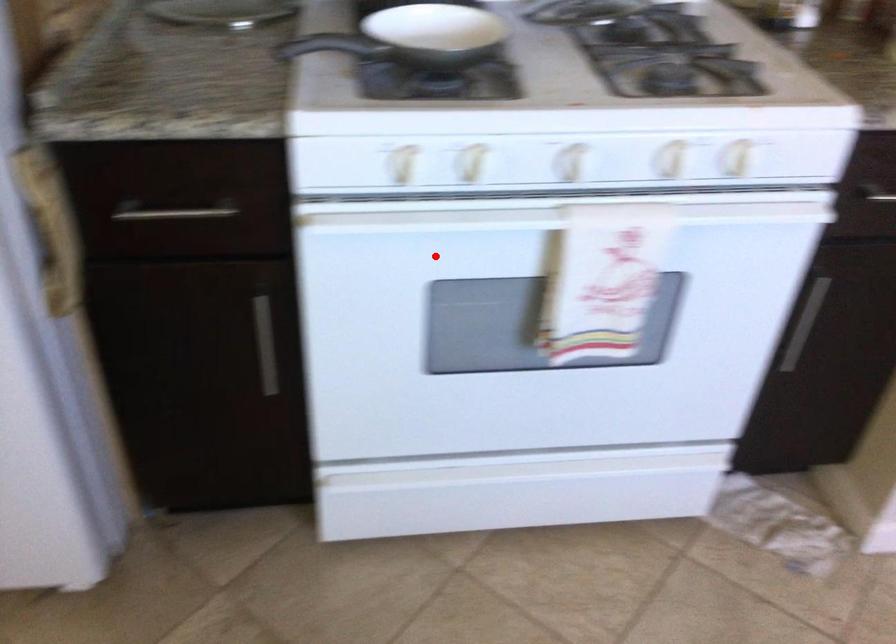
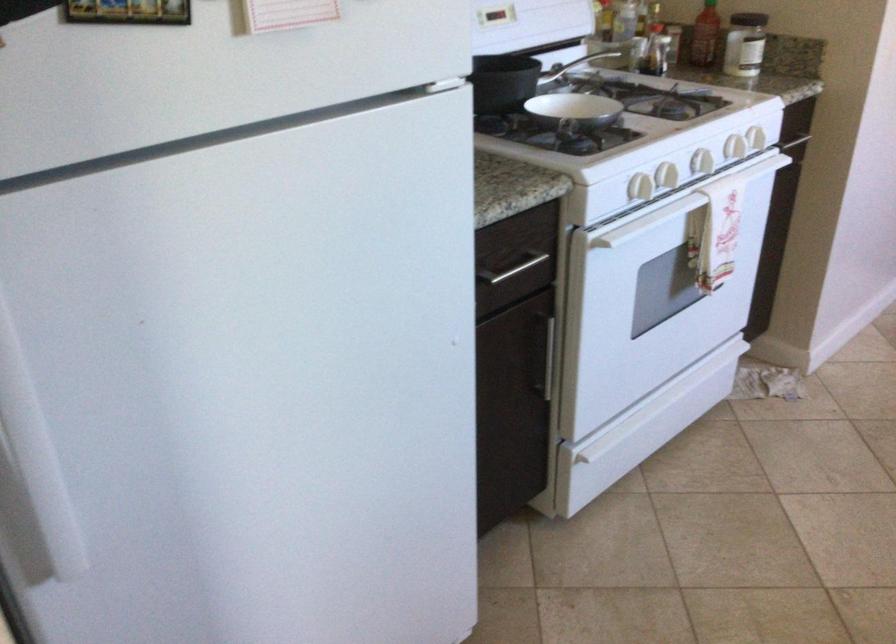
Question: I am providing you with two images of the same scene from different viewpoints. Image1 has a red point marked. In image2, the corresponding 3D location appears at what relative position? Reply with the corresponding letter.

Choices:
 (A) Closer
 (B) Farther

Answer: (B)